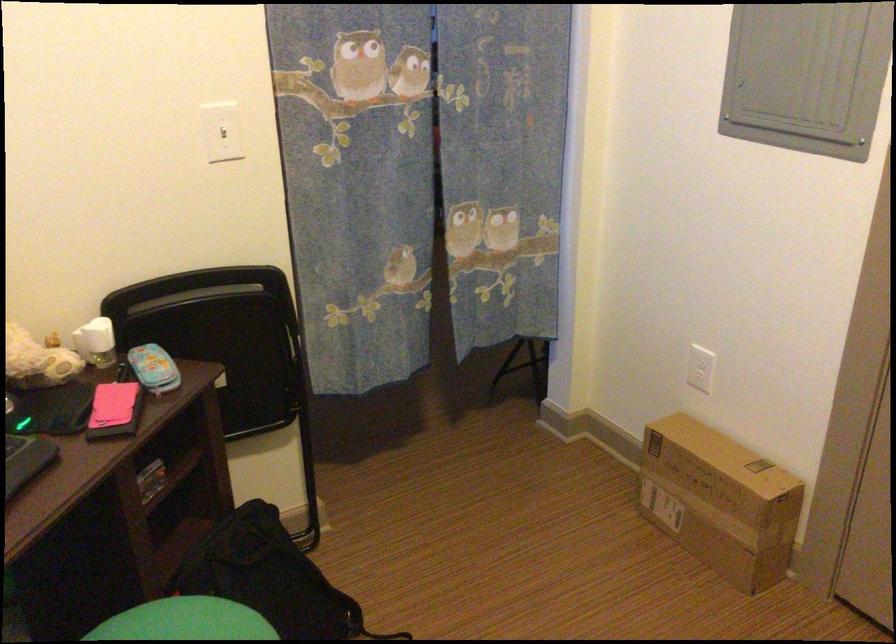
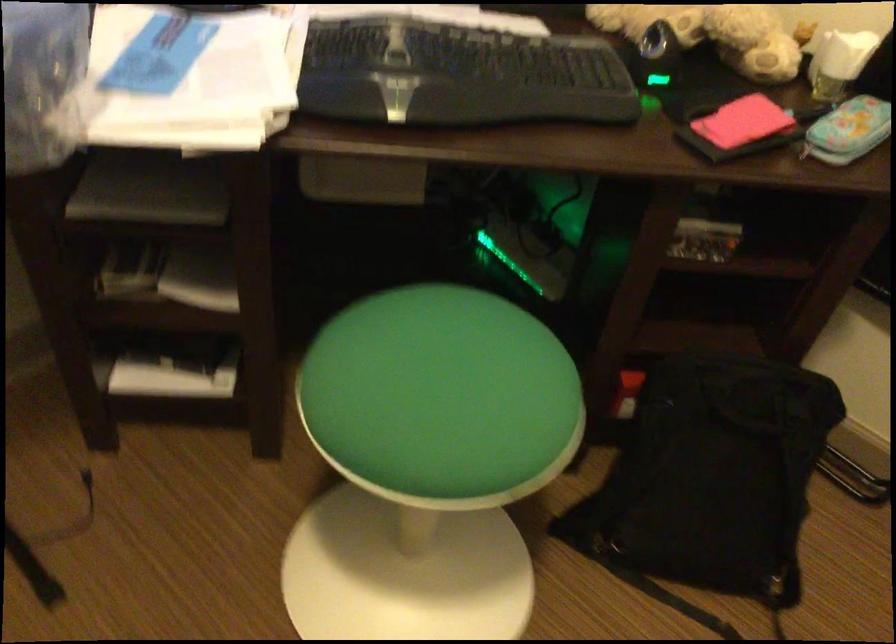
Where in the second image is the point corresponding to point (167, 366) from the first image?

(848, 129)